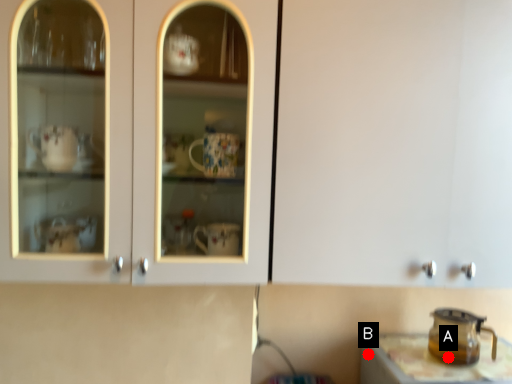
Question: Two points are circled on the image, labeled by A and B beside each circle. Which point is farther from the camera taking this photo?

Choices:
 (A) A is further
 (B) B is further

Answer: (B)